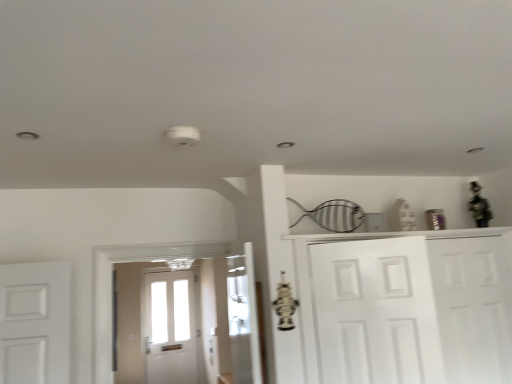
Question: Does white matte door at center, which ranks as the second door in back-to-front order, appear on the right side of white matte cabinet at right?

Choices:
 (A) yes
 (B) no

Answer: (B)

Question: Is white matte door at center, which ranks as the second door in back-to-front order, positioned before white matte cabinet at right?

Choices:
 (A) no
 (B) yes

Answer: (B)

Question: Is white matte door at center, positioned as the first door in front-to-back order, shorter than white matte cabinet at right?

Choices:
 (A) yes
 (B) no

Answer: (A)

Question: Would you consider white matte door at center, the second door when ordered from right to left, to be distant from white matte cabinet at right?

Choices:
 (A) no
 (B) yes

Answer: (A)

Question: Does white matte door at center, the second door when ordered from right to left, have a smaller size compared to white matte cabinet at right?

Choices:
 (A) yes
 (B) no

Answer: (A)

Question: From a real-world perspective, is white matte cabinet at right positioned above or below white matte door at center, the 1th door from the left?

Choices:
 (A) above
 (B) below

Answer: (B)

Question: Does point click(459, 258) appear closer or farther from the camera than point click(335, 274)?

Choices:
 (A) closer
 (B) farther

Answer: (B)

Question: In the image, is white matte cabinet at right on the left side or the right side of white matte door at center, which ranks as the second door in back-to-front order?

Choices:
 (A) left
 (B) right

Answer: (B)

Question: Considering the positions of white matte cabinet at right and white matte door at center, which ranks as the second door in back-to-front order, in the image, is white matte cabinet at right wider or thinner than white matte door at center, which ranks as the second door in back-to-front order,?

Choices:
 (A) thin
 (B) wide

Answer: (B)

Question: Would you say white matte door at right, positioned as the second door in front-to-back order, is inside or outside white matte cabinet at right?

Choices:
 (A) outside
 (B) inside

Answer: (B)

Question: From the image's perspective, relative to white matte cabinet at right, is white matte door at right, positioned as the second door in front-to-back order, above or below?

Choices:
 (A) below
 (B) above

Answer: (B)

Question: From a real-world perspective, is white matte door at right, the 2th door viewed from the left, positioned above or below white matte cabinet at right?

Choices:
 (A) below
 (B) above

Answer: (B)

Question: Considering the positions of white matte door at right, the 2th door viewed from the left, and white matte cabinet at right in the image, is white matte door at right, the 2th door viewed from the left, taller or shorter than white matte cabinet at right?

Choices:
 (A) tall
 (B) short

Answer: (B)

Question: Is white matte door at center, which ranks as the second door in back-to-front order, to the left or to the right of white matte cabinet at right in the image?

Choices:
 (A) left
 (B) right

Answer: (A)

Question: In terms of size, does white matte door at center, the 1th door from the left, appear bigger or smaller than white matte cabinet at right?

Choices:
 (A) big
 (B) small

Answer: (B)